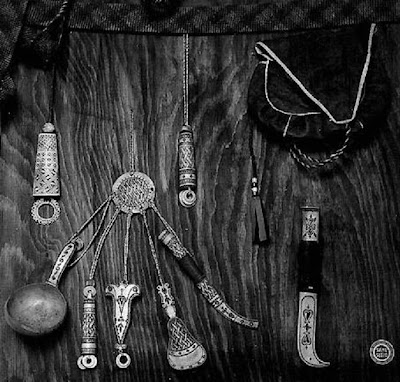
Where is `tip of spoon`? tip of spoon is located at coordinates (26, 327).